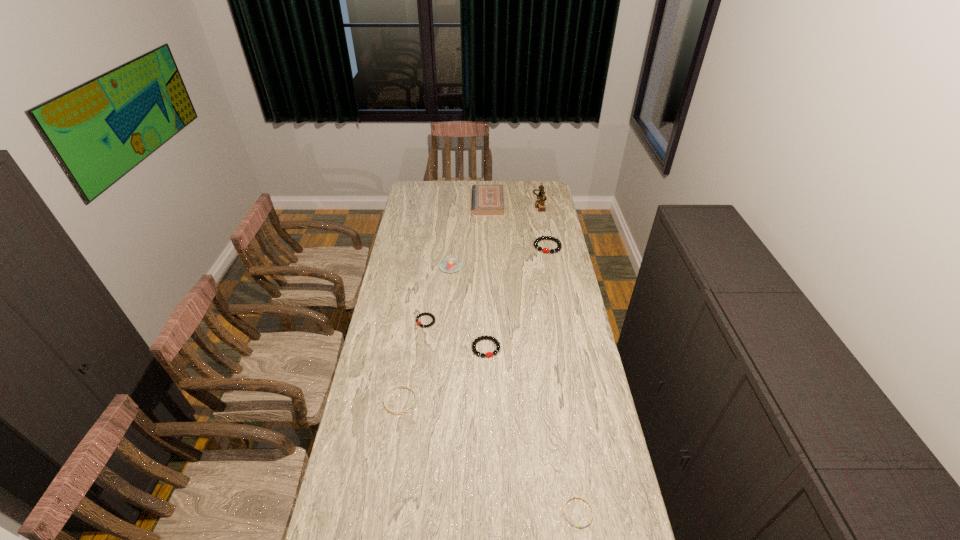
Identify the location of vacant area situated on the spine side of the Bible. The width and height of the screenshot is (960, 540). (435, 203).

Image resolution: width=960 pixels, height=540 pixels. In order to click on free region located 0.170m on the spine side of the Bible in this screenshot , I will do `click(444, 203)`.

Identify the location of blank space located 0.120m on the front of the third tallest object. (448, 291).

Locate an element on the screen. The height and width of the screenshot is (540, 960). vacant space located 0.120m on the left of the fifth shortest object is located at coordinates click(x=511, y=246).

This screenshot has height=540, width=960. In order to click on free space located on the front of the nearest black bracelet in this screenshot , I will do `click(487, 402)`.

Image resolution: width=960 pixels, height=540 pixels. In order to click on free spot located on the surface of the bigger blue bracelet showing star-shaped elements in this screenshot , I will do `click(444, 401)`.

Locate an element on the screen. This screenshot has height=540, width=960. free space located on the back of the leftmost black bracelet is located at coordinates (429, 296).

Locate an element on the screen. The image size is (960, 540). telephone that is at the far edge is located at coordinates (540, 204).

Where is `Bible located at the far edge`? This screenshot has width=960, height=540. Bible located at the far edge is located at coordinates (487, 199).

This screenshot has width=960, height=540. I want to click on object at the left edge, so click(x=390, y=390).